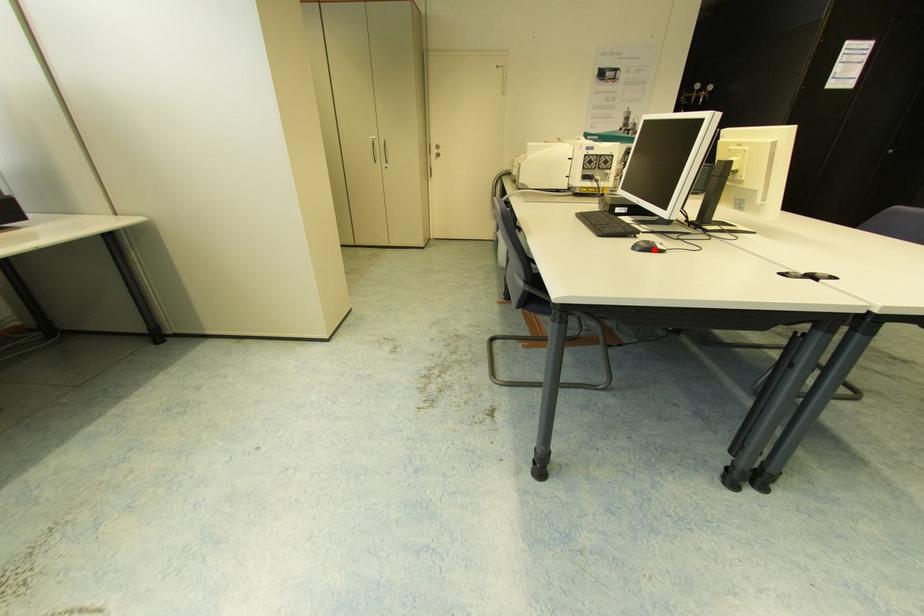
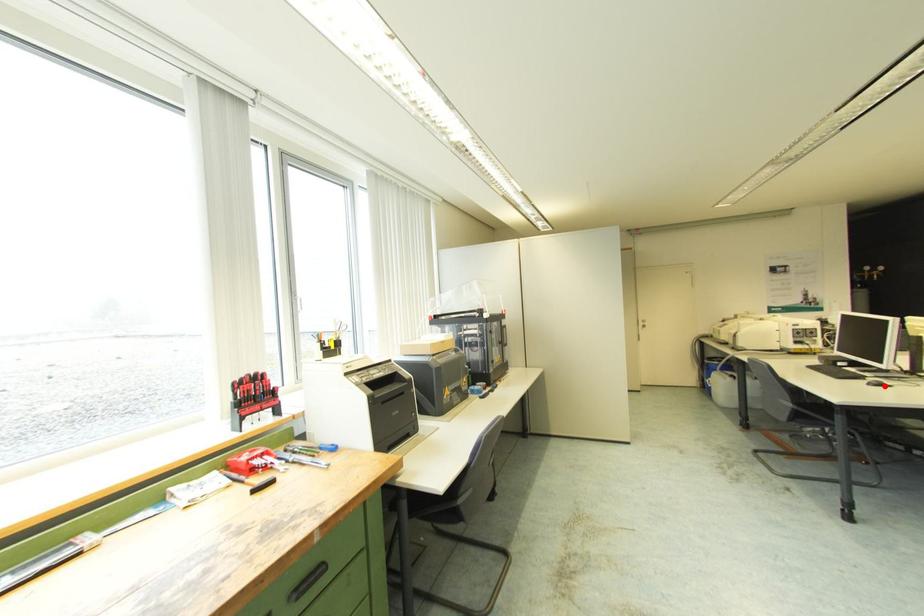
I am providing you with two images of the same scene from different viewpoints. A red point is marked on the first image and another point is marked on the second image. Is the red point in image1 aligned with the point shown in image2?

Yes